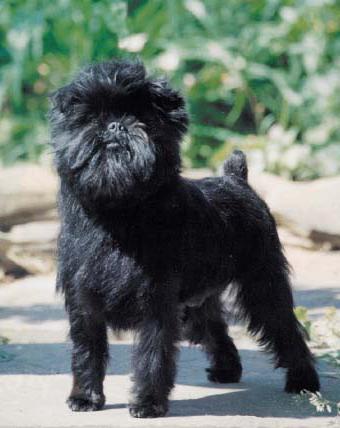
What are the coordinates of `chest` in the screenshot? It's located at (120, 253).